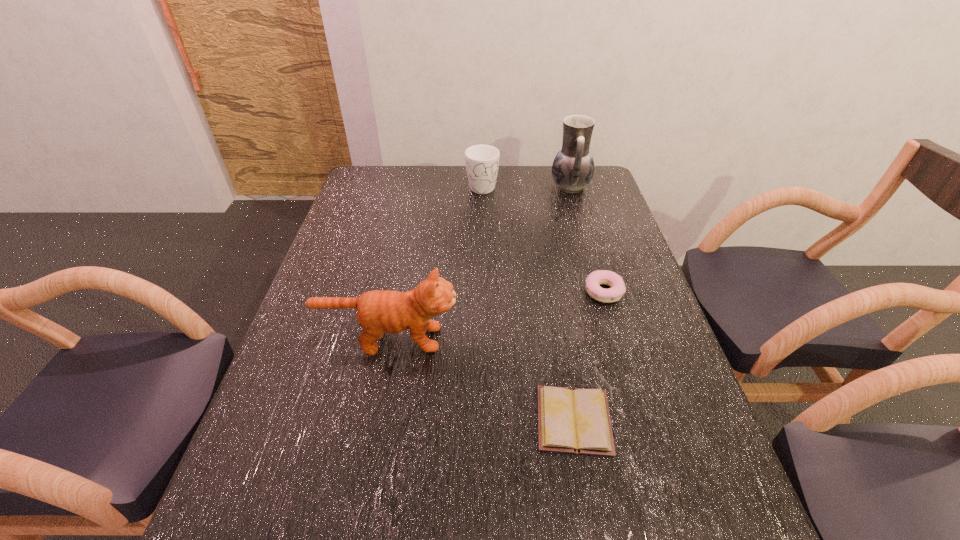
At what (x,y) coordinates should I click in order to perform the action: click on pitcher. Please return your answer as a coordinate pair (x, y). The image size is (960, 540). Looking at the image, I should click on (573, 167).

Where is `the second tallest object`? This screenshot has width=960, height=540. the second tallest object is located at coordinates (378, 311).

Where is `the leftmost object`? The image size is (960, 540). the leftmost object is located at coordinates (378, 311).

Find the location of a particular element. Image resolution: width=960 pixels, height=540 pixels. the third tallest object is located at coordinates (482, 161).

You are a GUI agent. You are given a task and a screenshot of the screen. Output one action in this format:
    pyautogui.click(x=<x>, y=<y>)
    Task: Click on the mug
    This screenshot has width=960, height=540.
    Given the screenshot: What is the action you would take?
    pyautogui.click(x=482, y=161)

In order to click on the second shortest object in this screenshot , I will do `click(593, 281)`.

Locate an element on the screen. the third farthest object is located at coordinates (593, 281).

Where is `the nearest object`? Image resolution: width=960 pixels, height=540 pixels. the nearest object is located at coordinates (577, 420).

At what (x,y) coordinates should I click in order to perform the action: click on the shortest object. Please return your answer as a coordinate pair (x, y). The image size is (960, 540). Looking at the image, I should click on (577, 420).

Locate an element on the screen. The height and width of the screenshot is (540, 960). free space located on the front-facing side of the pitcher is located at coordinates (525, 187).